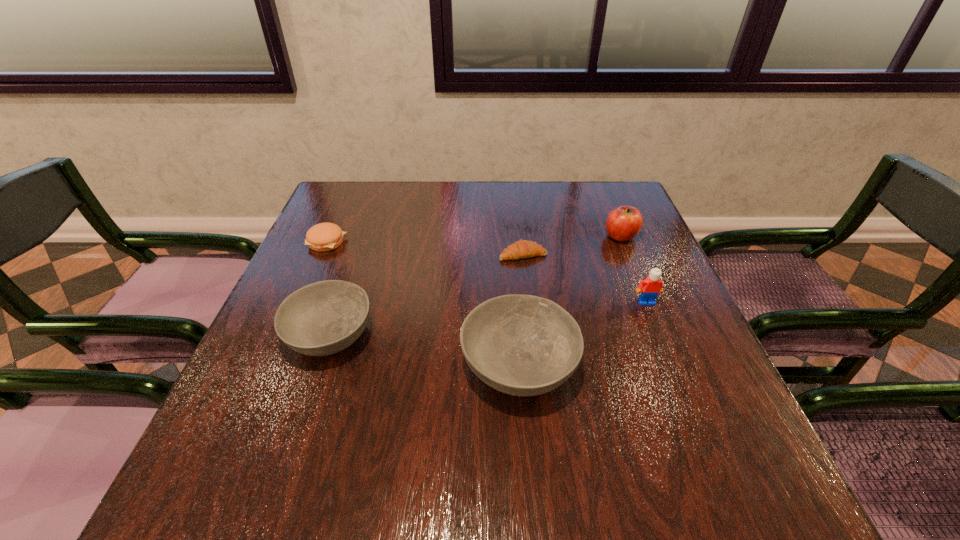
In order to click on free space located 0.180m on the face of the Lego in this screenshot , I will do `click(674, 372)`.

Find the location of a particular element. Image resolution: width=960 pixels, height=540 pixels. blank space located 0.340m on the left of the apple is located at coordinates (477, 237).

You are a GUI agent. You are given a task and a screenshot of the screen. Output one action in this format:
    pyautogui.click(x=<x>, y=<y>)
    Task: Click on the vacant space situated on the back of the patty
    
    Given the screenshot: What is the action you would take?
    pyautogui.click(x=347, y=197)

I want to click on object that is at the near edge, so click(x=523, y=345).

I want to click on bowl located at the left edge, so click(323, 318).

Where is `patty at the left edge`? The width and height of the screenshot is (960, 540). patty at the left edge is located at coordinates click(321, 237).

Where is `Lego that is at the right edge`? Lego that is at the right edge is located at coordinates (651, 286).

The height and width of the screenshot is (540, 960). I want to click on apple present at the right edge, so click(x=623, y=223).

At what (x,y) coordinates should I click in order to perform the action: click on free point at the far edge. Please return your answer as a coordinate pair (x, y). Image resolution: width=960 pixels, height=540 pixels. Looking at the image, I should click on pos(386,203).

Find the location of `blank space at the near edge`. blank space at the near edge is located at coordinates (401, 409).